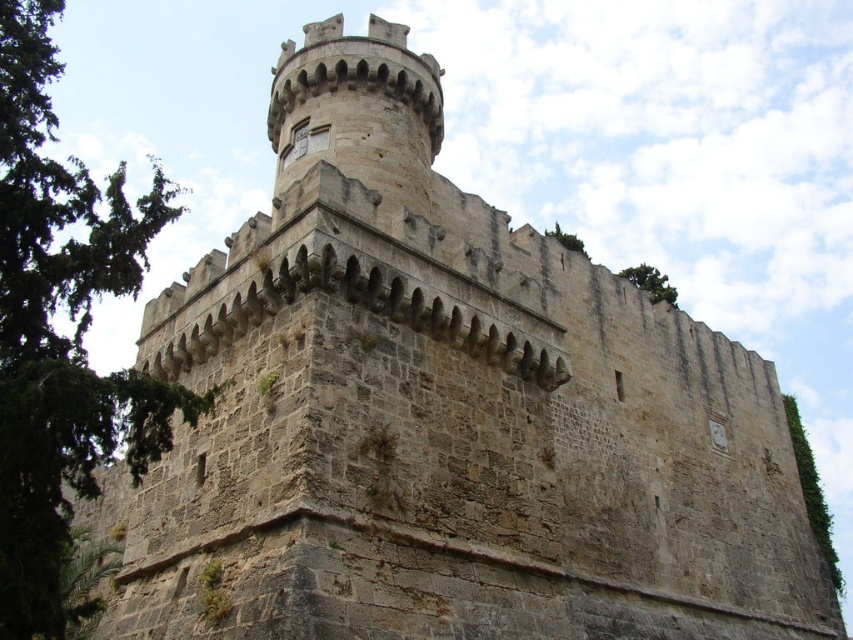
Based on the photo, which of these two, green leafy tree at lower right or green leafy tree at upper right, stands taller?

green leafy tree at lower right is taller.

Which is behind, point (810, 468) or point (647, 266)?

The point (647, 266) is behind.

The width and height of the screenshot is (853, 640). Identify the location of green leafy tree at lower right. (811, 492).

Is green leafy tree at lower right wider than green leafy tree at upper center?

In fact, green leafy tree at lower right might be narrower than green leafy tree at upper center.

Which of these two, green leafy tree at lower right or green leafy tree at upper center, stands shorter?

With less height is green leafy tree at upper center.

Is point (799, 449) farther from camera compared to point (573, 236)?

No.

At what (x,y) coordinates should I click in order to perform the action: click on green leafy tree at lower right. Please return your answer as a coordinate pair (x, y). This screenshot has width=853, height=640. Looking at the image, I should click on [811, 492].

Measure the distance between point (651, 298) and camera.

The distance of point (651, 298) from camera is 71.10 meters.

Can you confirm if green leafy tree at upper right is taller than green leafy tree at upper center?

Incorrect, green leafy tree at upper right's height is not larger of green leafy tree at upper center's.

What are the coordinates of `green leafy tree at upper right` in the screenshot? It's located at (650, 282).